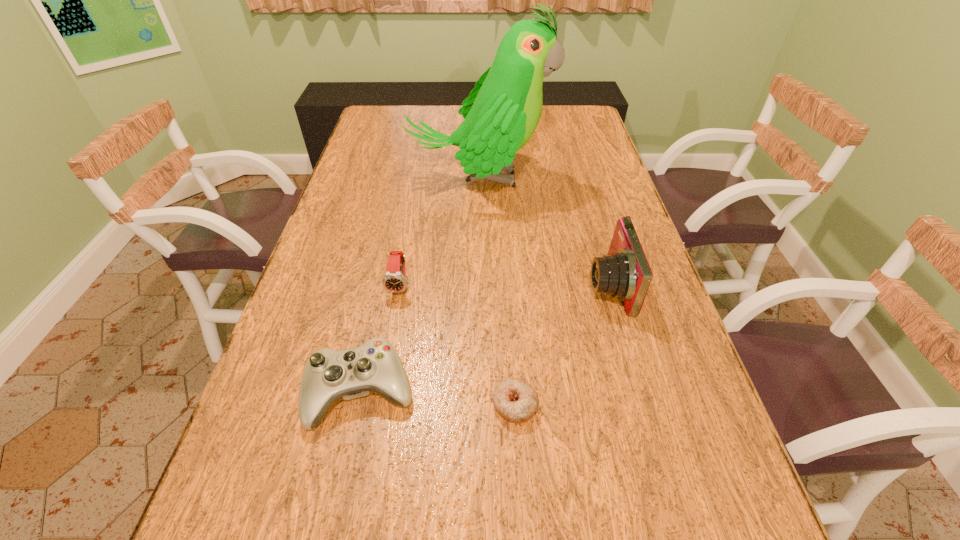
What are the coordinates of `vacant space located on the front-facing side of the camera` in the screenshot? It's located at (435, 285).

In order to click on free space located 0.200m on the face of the watch in this screenshot , I will do `click(385, 371)`.

I want to click on free space located 0.080m on the back of the control, so click(376, 325).

Where is `free spot located 0.310m on the right of the shortest object`? This screenshot has width=960, height=540. free spot located 0.310m on the right of the shortest object is located at coordinates click(x=699, y=404).

The height and width of the screenshot is (540, 960). In order to click on object that is at the left edge in this screenshot , I will do `click(375, 366)`.

Find the location of a particular element. object present at the right edge is located at coordinates (624, 273).

The width and height of the screenshot is (960, 540). Identify the location of blank space at the left edge of the desktop. (396, 135).

Identify the location of vacant space at the right edge. This screenshot has width=960, height=540. (575, 151).

The width and height of the screenshot is (960, 540). Find the location of `free region at the far left corner of the desktop`. free region at the far left corner of the desktop is located at coordinates (396, 113).

Where is `free location at the far right corner`? The width and height of the screenshot is (960, 540). free location at the far right corner is located at coordinates (574, 120).